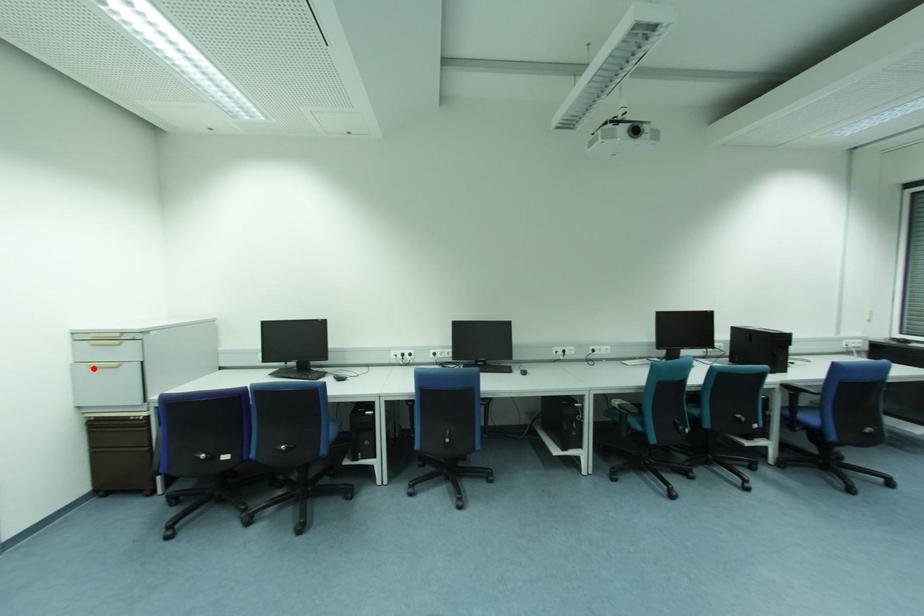
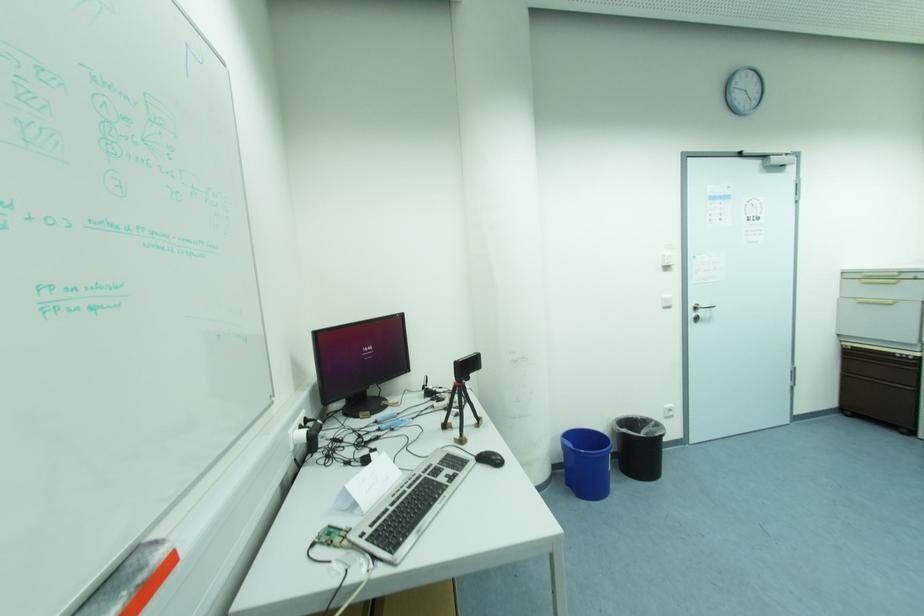
Question: I am providing you with two images of the same scene from different viewpoints. A red point is marked on the first image. Can you still see the location of the red point in image 2?

Choices:
 (A) Yes
 (B) No

Answer: (A)